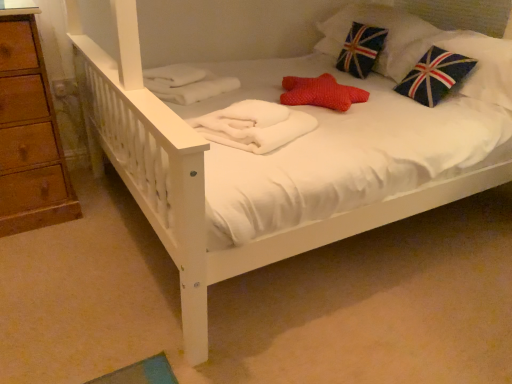
Question: Is velvet union jack pillow at upper right at the left side of white fluffy blanket at center?

Choices:
 (A) yes
 (B) no

Answer: (B)

Question: Does velvet union jack pillow at upper right have a greater width compared to white fluffy blanket at center?

Choices:
 (A) no
 (B) yes

Answer: (B)

Question: Considering the relative sizes of velvet union jack pillow at upper right and white fluffy blanket at center in the image provided, is velvet union jack pillow at upper right bigger than white fluffy blanket at center?

Choices:
 (A) no
 (B) yes

Answer: (B)

Question: Is velvet union jack pillow at upper right facing away from white fluffy blanket at center?

Choices:
 (A) no
 (B) yes

Answer: (A)

Question: Considering the relative positions of velvet union jack pillow at upper right and white fluffy blanket at center in the image provided, is velvet union jack pillow at upper right in front of white fluffy blanket at center?

Choices:
 (A) no
 (B) yes

Answer: (A)

Question: Is velvet union jack pillow at upper right smaller than white fluffy blanket at center?

Choices:
 (A) no
 (B) yes

Answer: (A)

Question: Considering the relative sizes of white fluffy blanket at center and velvet union jack pillow at upper right in the image provided, is white fluffy blanket at center shorter than velvet union jack pillow at upper right?

Choices:
 (A) yes
 (B) no

Answer: (A)

Question: Is white fluffy blanket at center surrounding velvet union jack pillow at upper right?

Choices:
 (A) yes
 (B) no

Answer: (B)

Question: Can you confirm if white fluffy blanket at center is taller than velvet union jack pillow at upper right?

Choices:
 (A) yes
 (B) no

Answer: (B)

Question: Does white fluffy blanket at center have a lesser width compared to velvet union jack pillow at upper right?

Choices:
 (A) no
 (B) yes

Answer: (B)

Question: Is white fluffy blanket at center positioned in front of velvet union jack pillow at upper right?

Choices:
 (A) yes
 (B) no

Answer: (A)

Question: From a real-world perspective, is white fluffy blanket at center positioned over velvet union jack pillow at upper right based on gravity?

Choices:
 (A) yes
 (B) no

Answer: (B)

Question: Is white fluffy blanket at center in front of or behind velvet union jack pillow at upper right in the image?

Choices:
 (A) behind
 (B) front

Answer: (B)